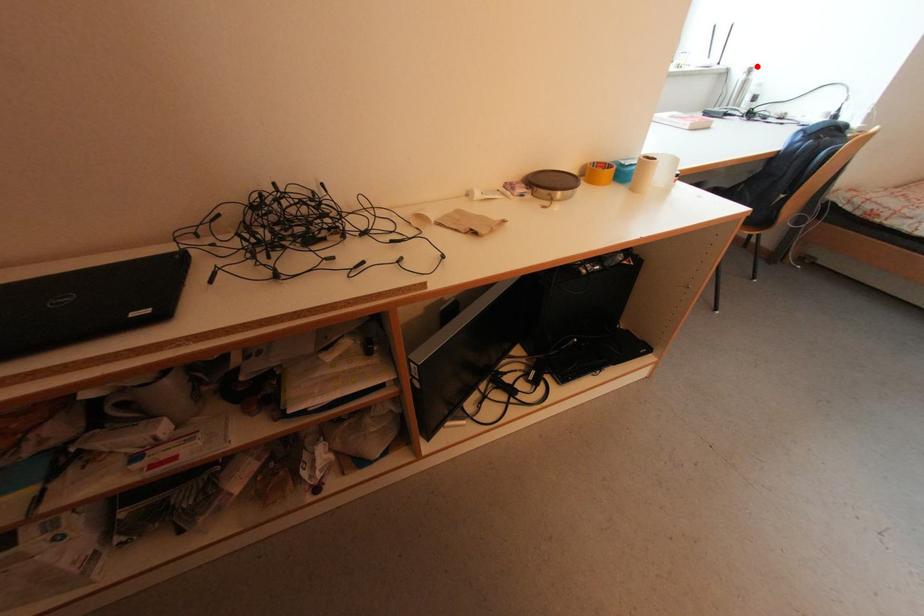
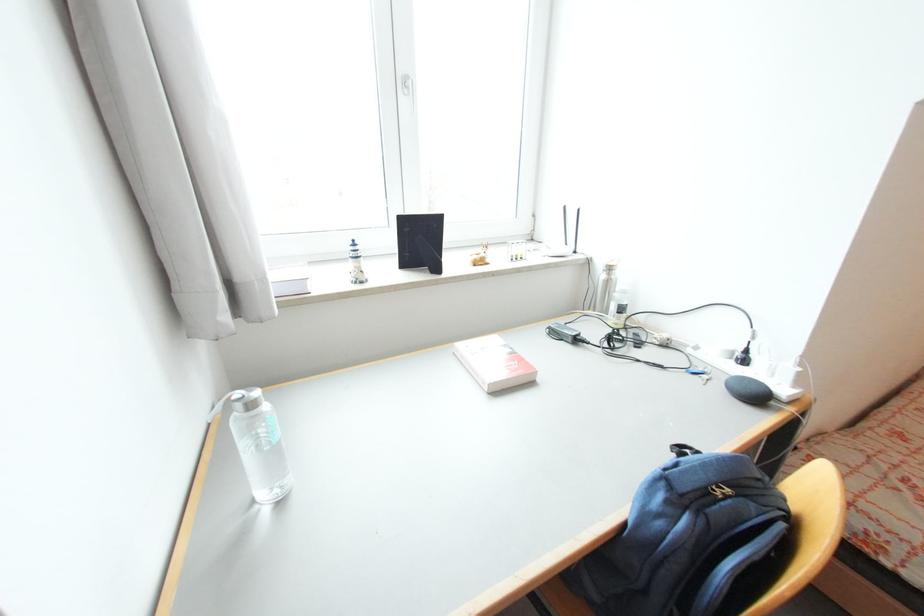
Question: I am providing you with two images of the same scene from different viewpoints. A red point is marked on the first image. At the location where the point appears in image 1, is it still visible in image 2?

Choices:
 (A) Yes
 (B) No

Answer: (A)